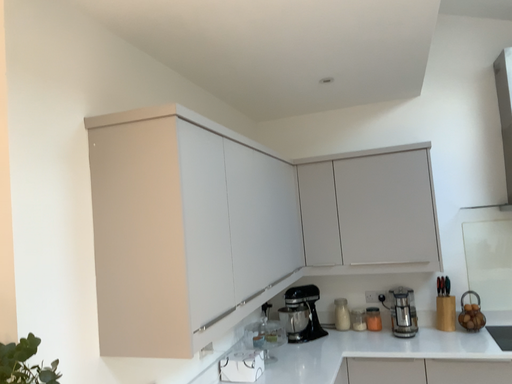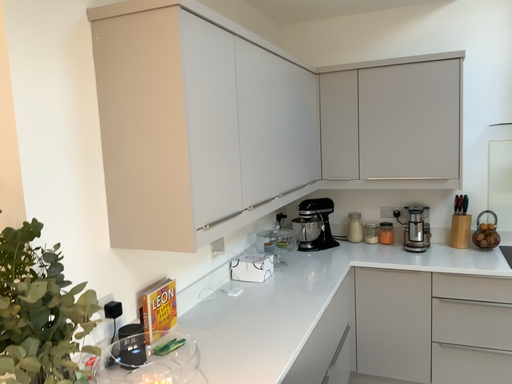
Question: Which way did the camera rotate in the video?

Choices:
 (A) rotated upward
 (B) rotated downward

Answer: (B)